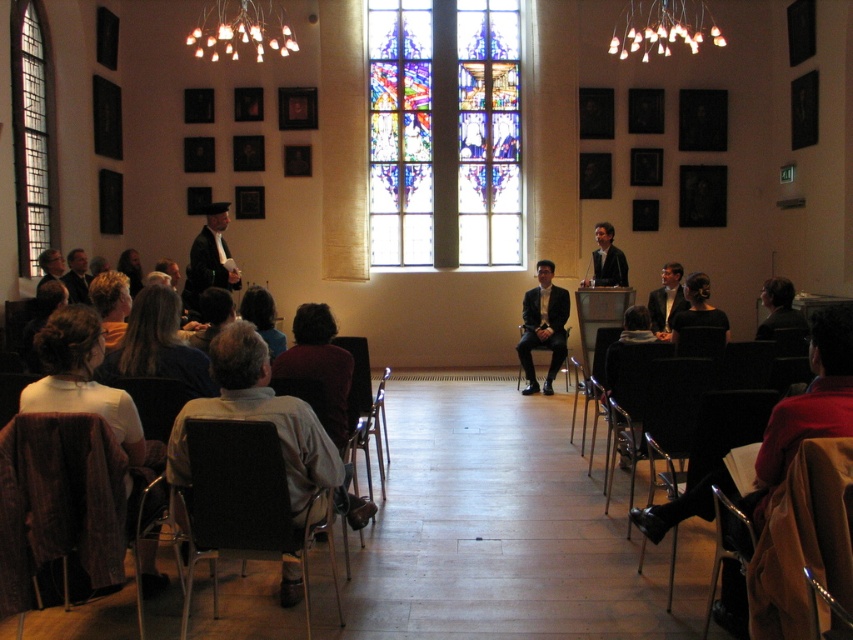
You are a photographer at the event and need to capture a photo of both the black fabric dress at center and the dark brown hair at center. Since the camera has a limited focus range, will the difference in their sizes affect the ability to focus on both subjects simultaneously?

The black fabric dress at center is wider than the dark brown hair at center, but since the camera focuses on subjects within its range regardless of size differences, both can be captured in focus as long as they are within the same focal plane.